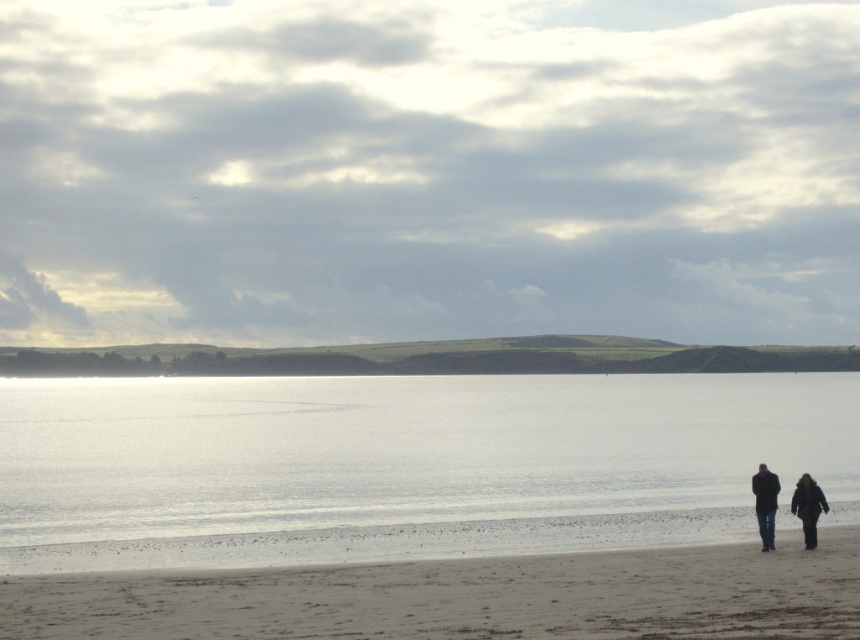
Is dark brown leather jacket at lower right to the right of dark blue jeans at lower right from the viewer's perspective?

Correct, you'll find dark brown leather jacket at lower right to the right of dark blue jeans at lower right.

Measure the distance between dark brown leather jacket at lower right and camera.

dark brown leather jacket at lower right is 27.47 meters from camera.

Where is `dark brown leather jacket at lower right`? The height and width of the screenshot is (640, 860). dark brown leather jacket at lower right is located at coordinates (765, 502).

From the picture: Which of these two, dark brown leather jacket at lower right or black matte coat at lower right, stands shorter?

Standing shorter between the two is black matte coat at lower right.

Which is below, dark brown leather jacket at lower right or black matte coat at lower right?

black matte coat at lower right is lower down.

The image size is (860, 640). Describe the element at coordinates (765, 502) in the screenshot. I see `dark brown leather jacket at lower right` at that location.

The height and width of the screenshot is (640, 860). What are the coordinates of `dark brown leather jacket at lower right` in the screenshot? It's located at (765, 502).

Which of these two, clear water at center or light brown sand at lower center, stands taller?

Standing taller between the two is clear water at center.

Is point (683, 406) less distant than point (679, 589)?

No, it is behind (679, 589).

This screenshot has height=640, width=860. Identify the location of clear water at center. (403, 465).